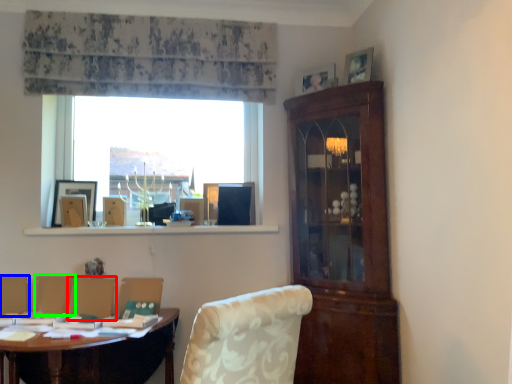
Question: Which is nearer to the armchair (highlighted by a red box)? armchair (highlighted by a blue box) or armchair (highlighted by a green box).

Choices:
 (A) armchair
 (B) armchair

Answer: (B)